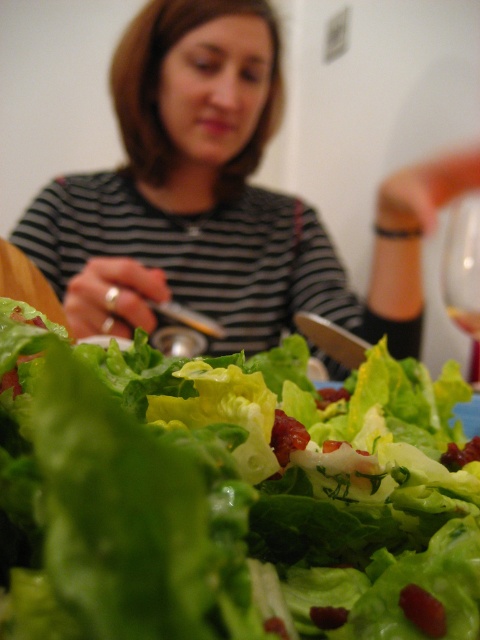
You are a food photographer trying to capture the salad and the glass in one shot. The camera can focus on objects within a 20 inch range. Can you include both the green leafy lettuce at center and the transparent glass at upper right in the same focused shot?

The distance between the green leafy lettuce at center and the transparent glass at upper right is 22.62 inches, which exceeds the camera focus range of 20 inches. Therefore, both cannot be in focus simultaneously.

You are looking at the salad and notice two points marked in the image. The first point is at coordinates point (445, 260) and the second is at point (467, 326). Which point is closer to you?

Point (445, 260) is further to the camera than point (467, 326), so the point closer to you is point (467, 326).

You are at a restaurant and see the striped fabric shirt at upper center and the translucent glass wine at center on the table. Which object is closer to you?

The striped fabric shirt at upper center is closer to you because it is in front of the translucent glass wine at center.